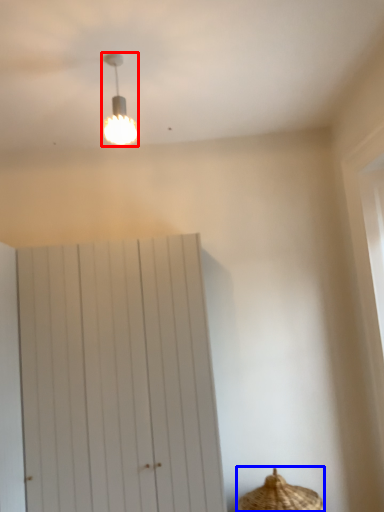
Question: Which object is further to the camera taking this photo, lamp (highlighted by a red box) or basket (highlighted by a blue box)?

Choices:
 (A) lamp
 (B) basket

Answer: (B)